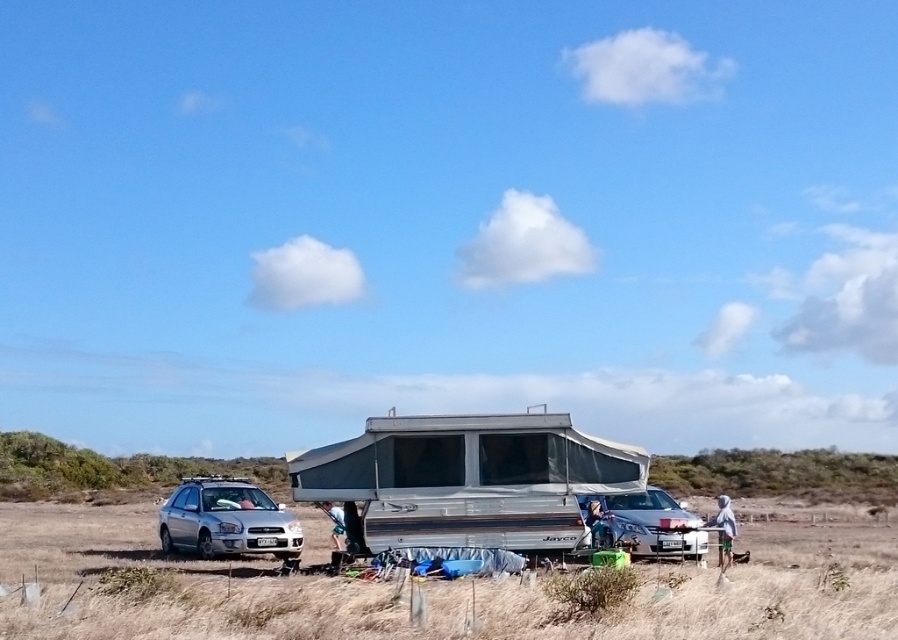
Between silver metallic pop-up camper at center and satin silver car at center, which one appears on the right side from the viewer's perspective?

From the viewer's perspective, satin silver car at center appears more on the right side.

How distant is silver metallic pop-up camper at center from satin silver car at center?

A distance of 13.45 feet exists between silver metallic pop-up camper at center and satin silver car at center.

Does point (582, 435) lie in front of point (643, 520)?

Yes, point (582, 435) is closer to viewer.

Where is `silver metallic pop-up camper at center`? This screenshot has height=640, width=898. silver metallic pop-up camper at center is located at coordinates (467, 481).

Who is positioned more to the left, silver metallic pop-up camper at center or satin silver car at left?

From the viewer's perspective, satin silver car at left appears more on the left side.

Between point (359, 445) and point (271, 516), which one is positioned in front?

Positioned in front is point (359, 445).

This screenshot has height=640, width=898. In order to click on silver metallic pop-up camper at center in this screenshot , I will do `click(467, 481)`.

Which is more to the right, satin silver car at left or satin silver car at center?

satin silver car at center

Looking at this image, who is more forward, (271, 531) or (672, 525)?

Point (672, 525)

Where is `satin silver car at left`? satin silver car at left is located at coordinates (227, 520).